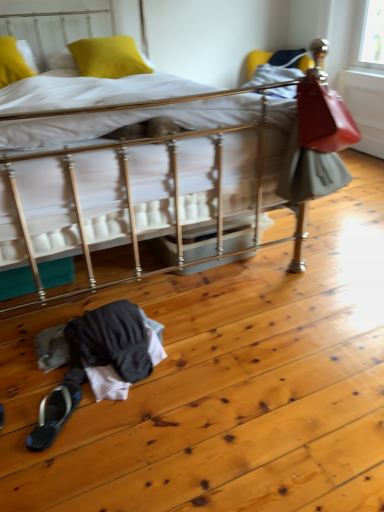
Question: Is yellow fabric pillow at upper left, which ranks as the second pillow in right-to-left order, to the left or to the right of yellow matte pillow at upper left, which is the 1th pillow from right to left, in the image?

Choices:
 (A) right
 (B) left

Answer: (B)

Question: From a real-world perspective, is yellow fabric pillow at upper left, the first pillow when ordered from left to right, above or below yellow matte pillow at upper left, which is the 1th pillow from right to left?

Choices:
 (A) below
 (B) above

Answer: (B)

Question: Based on their relative distances, which object is nearer to the yellow fabric pillow at upper left, which ranks as the second pillow in right-to-left order?

Choices:
 (A) black fabric slipper at lower left
 (B) yellow matte pillow at upper left, the second pillow positioned from the left
 (C) metallic silver bed at center

Answer: (B)

Question: Which object is positioned closest to the metallic silver bed at center?

Choices:
 (A) yellow fabric pillow at upper left, the first pillow when ordered from left to right
 (B) black fabric slipper at lower left
 (C) yellow matte pillow at upper left, which is the 1th pillow from right to left

Answer: (C)